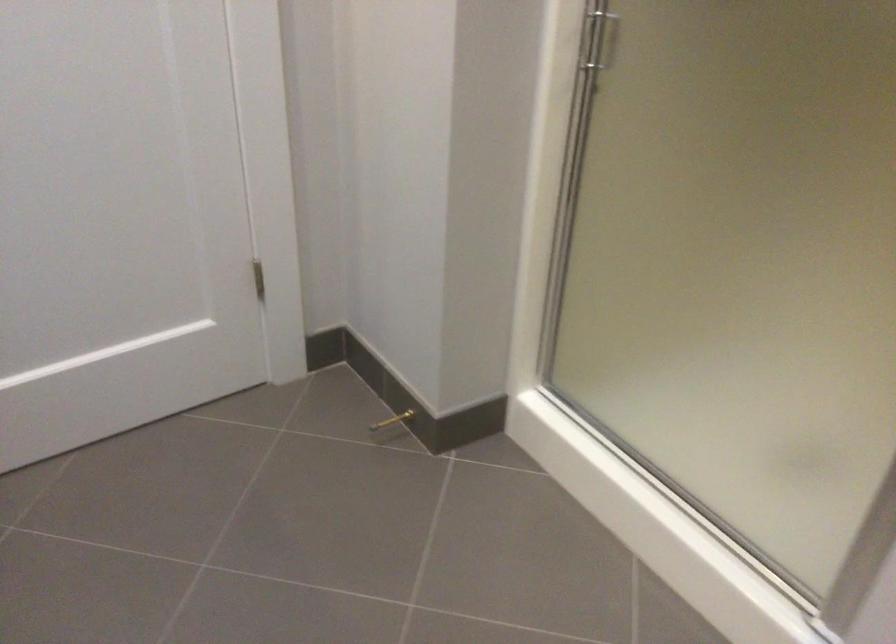
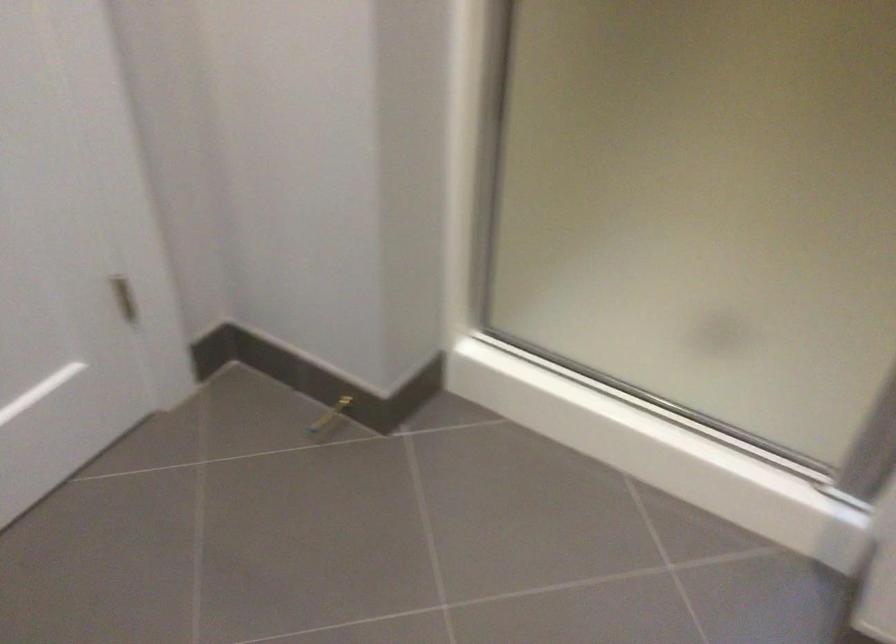
The images are taken continuously from a first-person perspective. In which direction are you moving?

The movement direction of the cameraman is left, forward.